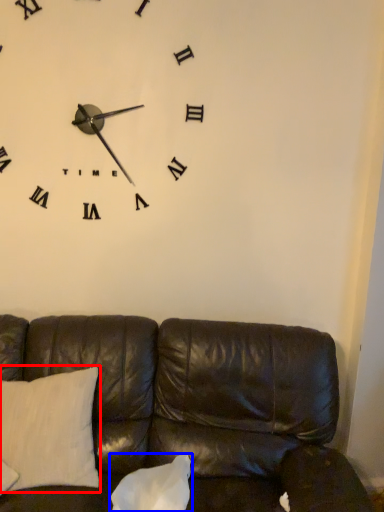
Question: Which object appears closest to the camera in this image, pillow (highlighted by a red box) or pillow (highlighted by a blue box)?

Choices:
 (A) pillow
 (B) pillow

Answer: (B)